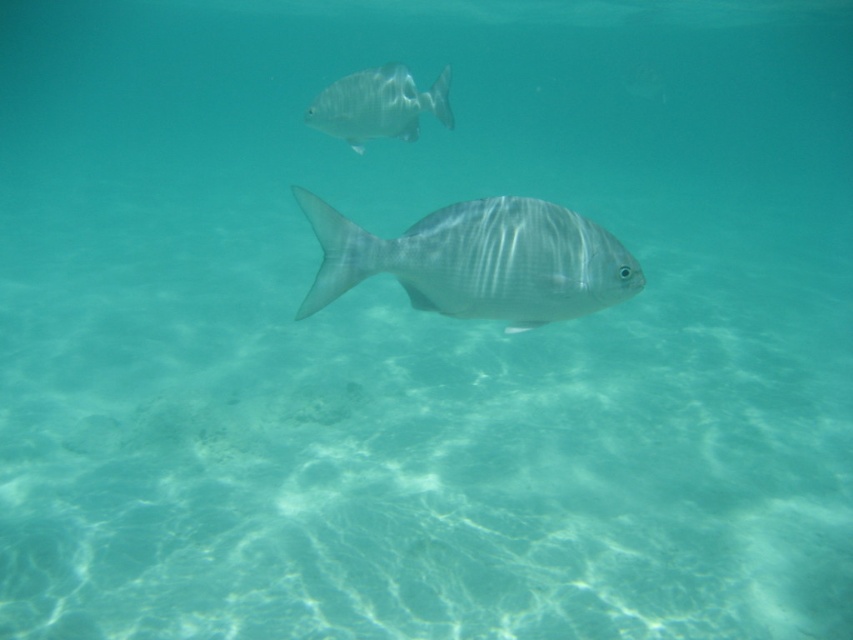
Can you confirm if shiny silver fish at center is thinner than silvery metallic fish at upper center?

In fact, shiny silver fish at center might be wider than silvery metallic fish at upper center.

Where is `shiny silver fish at center`? The image size is (853, 640). shiny silver fish at center is located at coordinates (479, 260).